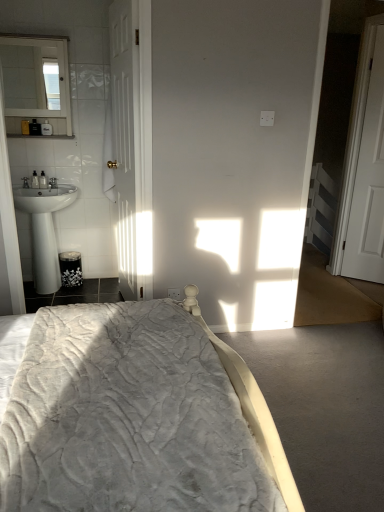
This screenshot has width=384, height=512. I want to click on vacant area on top of white glossy mirror at upper left (from a real-world perspective), so click(33, 35).